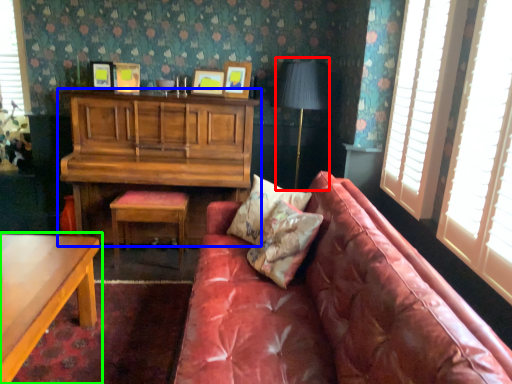
Question: Which is nearer to the table lamp (highlighted by a red box)? cabinetry (highlighted by a blue box) or table (highlighted by a green box).

Choices:
 (A) cabinetry
 (B) table

Answer: (A)